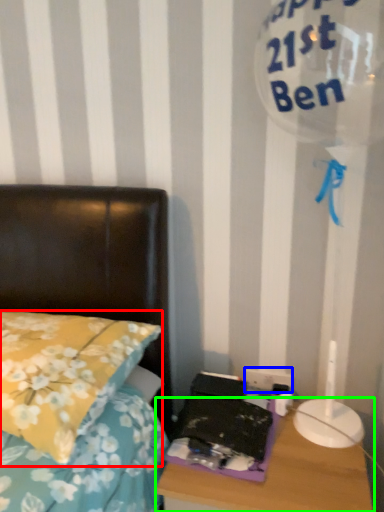
Question: Estimate the real-world distances between objects in this image. Which object is farther from pillow (highlighted by a red box), electric outlet (highlighted by a blue box) or nightstand (highlighted by a green box)?

Choices:
 (A) electric outlet
 (B) nightstand

Answer: (A)